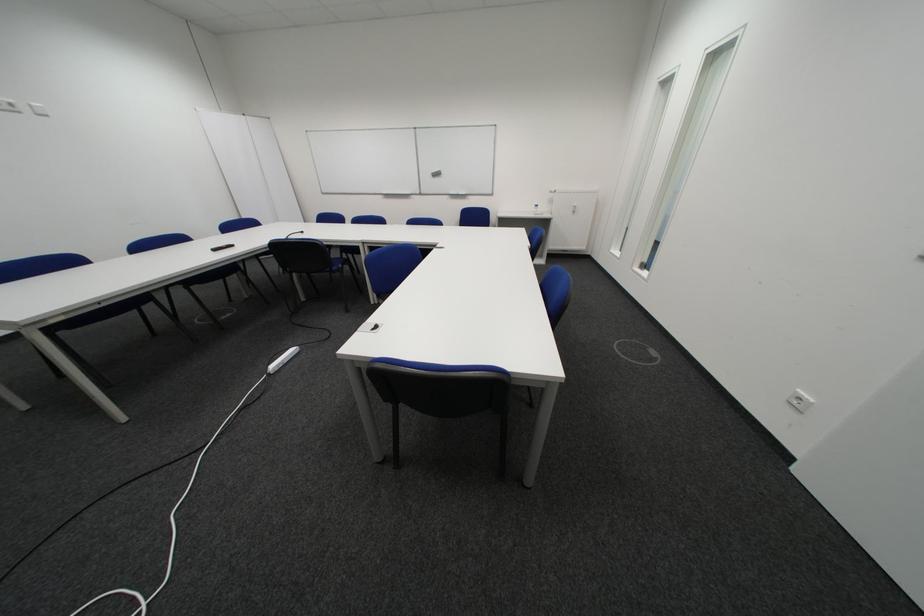
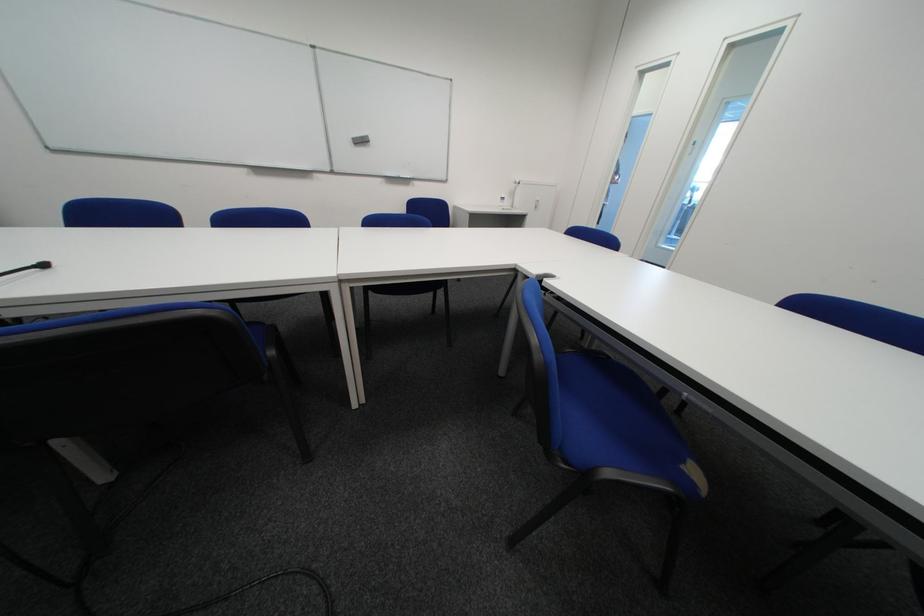
Locate, in the second image, the point that corresponds to (444,175) in the first image.

(365, 140)